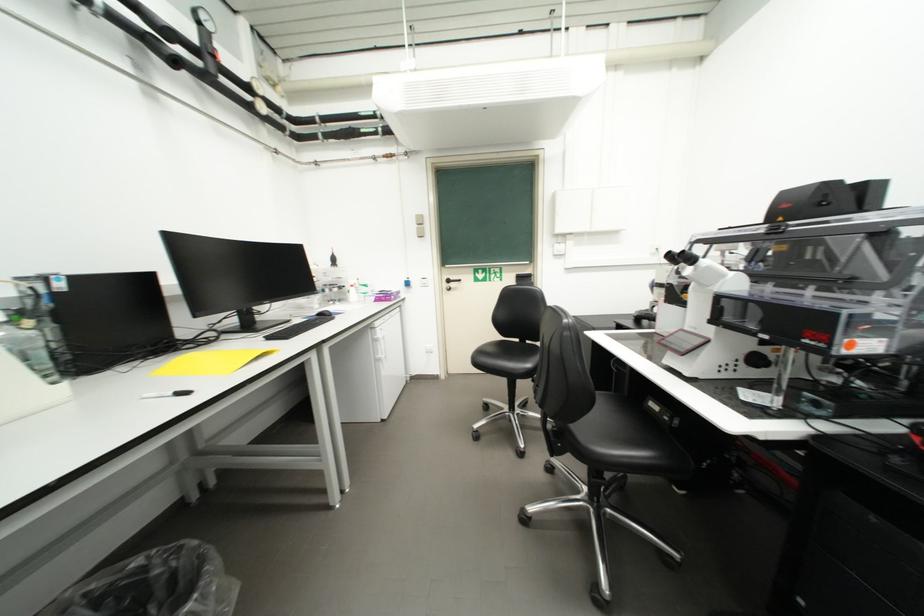
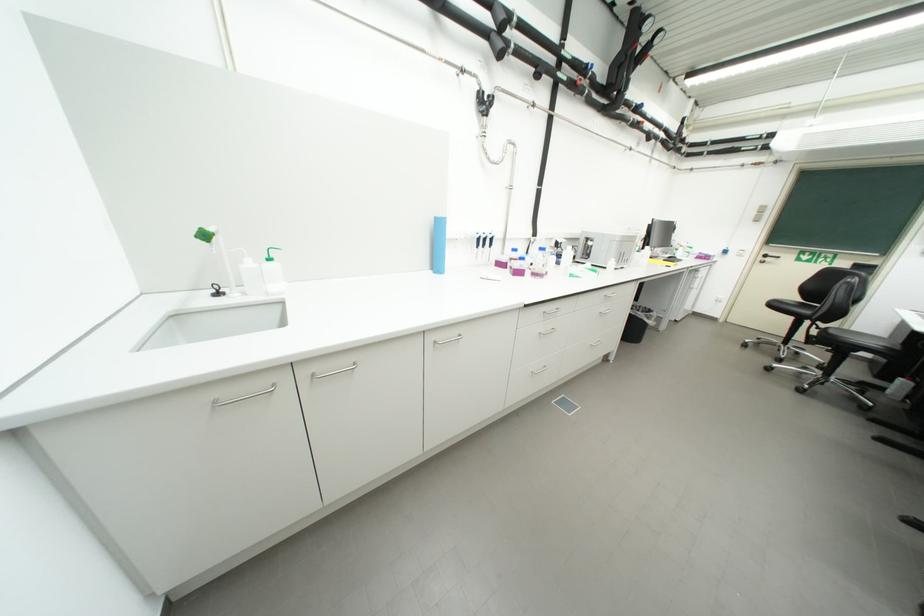
Locate, in the second image, the point that corresponds to (x=490, y=362) in the first image.

(783, 307)